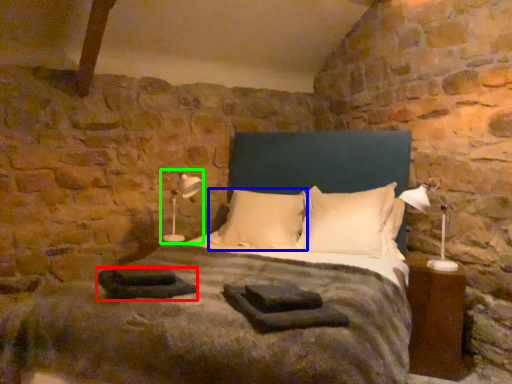
Question: Which is farther away from material (highlighted by a red box)? pillow (highlighted by a blue box) or table lamp (highlighted by a green box)?

Choices:
 (A) pillow
 (B) table lamp

Answer: (B)